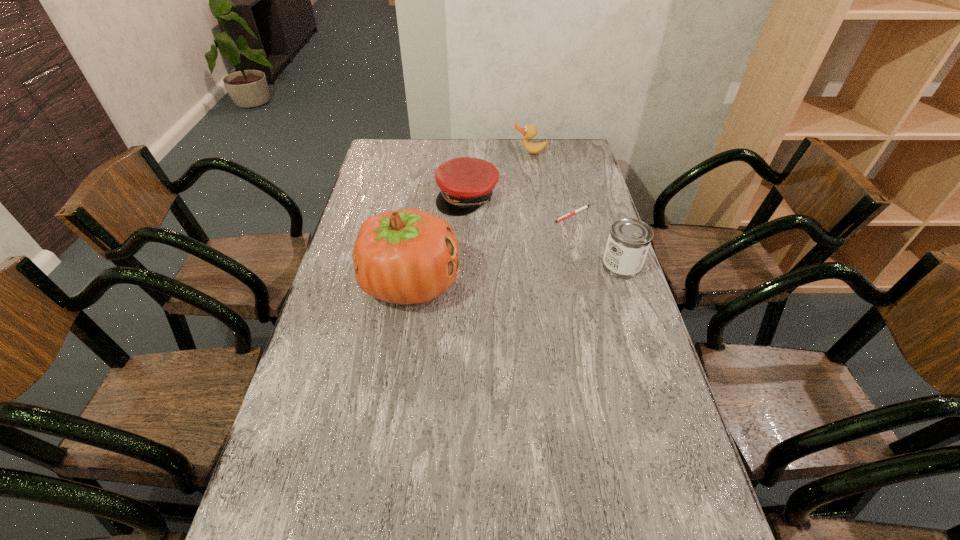
This screenshot has height=540, width=960. What are the coordinates of `free spot on the desktop that is between the tallest object and the can and is positioned on the beak of the duck` in the screenshot? It's located at (531, 273).

Locate an element on the screen. The image size is (960, 540). vacant space on the desktop that is between the pumpkin and the can and is positioned on the clicker of the shortest object is located at coordinates (548, 272).

Where is `vacant space on the desktop that is between the tallest object and the can and is positioned on the front-facing side of the cap`? Image resolution: width=960 pixels, height=540 pixels. vacant space on the desktop that is between the tallest object and the can and is positioned on the front-facing side of the cap is located at coordinates point(488,277).